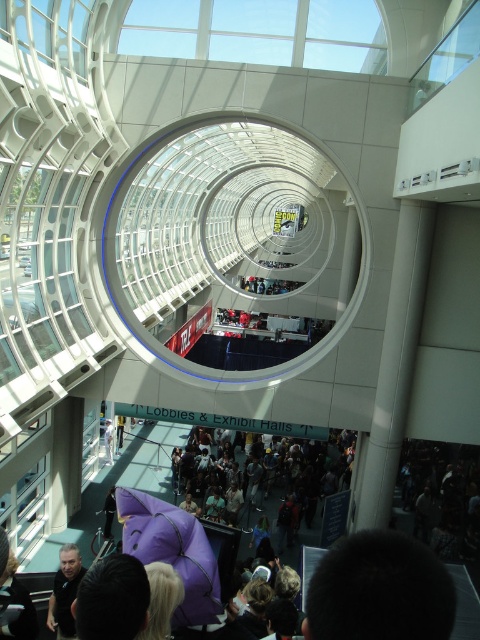
Question: Is purple fabric crowd at lower center closer to camera compared to dark gray shirt at lower left?

Choices:
 (A) no
 (B) yes

Answer: (B)

Question: Is purple fabric crowd at lower center below purple plush toy at center?

Choices:
 (A) yes
 (B) no

Answer: (A)

Question: Among these objects, which one is nearest to the camera?

Choices:
 (A) purple plush toy at center
 (B) purple fabric umbrella at center

Answer: (B)

Question: Which of the following is the farthest from the observer?

Choices:
 (A) (60, 596)
 (B) (109, 458)

Answer: (B)

Question: Among these objects, which one is farthest from the camera?

Choices:
 (A) dark gray shirt at lower left
 (B) purple plush toy at center

Answer: (B)

Question: Can you confirm if dark gray shirt at lower left is positioned below purple plush toy at center?

Choices:
 (A) no
 (B) yes

Answer: (B)